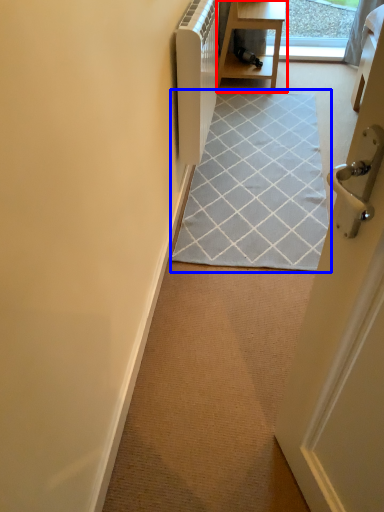
Question: Which of the following is the farthest to the observer, table (highlighted by a red box) or doormat (highlighted by a blue box)?

Choices:
 (A) table
 (B) doormat

Answer: (A)